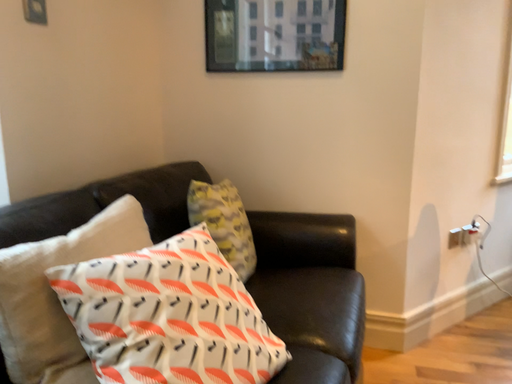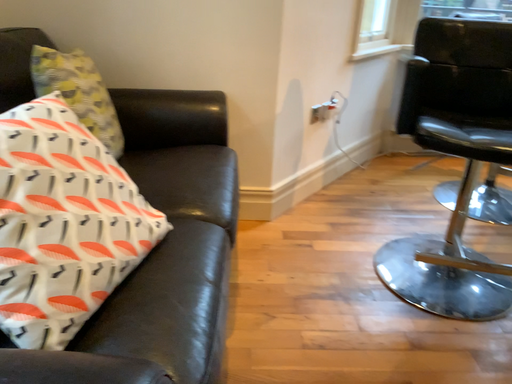
Question: Which way did the camera rotate in the video?

Choices:
 (A) rotated left
 (B) rotated right

Answer: (B)